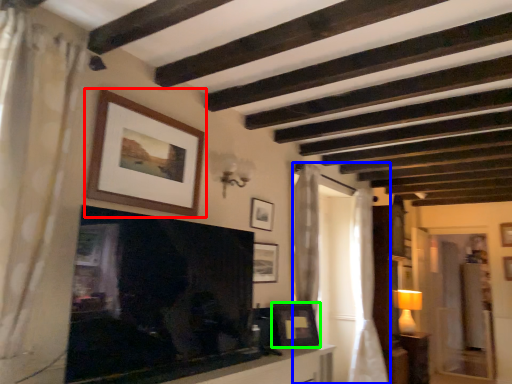
Question: Estimate the real-world distances between objects in this image. Which object is farther from picture frame (highlighted by a red box), curtain (highlighted by a blue box) or picture frame (highlighted by a green box)?

Choices:
 (A) curtain
 (B) picture frame

Answer: (A)